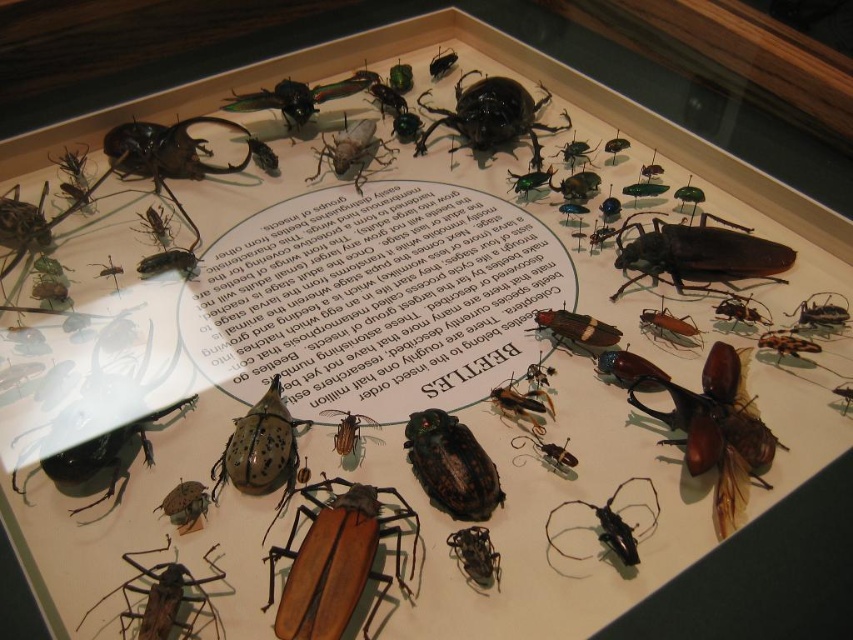
You are a photographer standing 1.2 meters away from the display case. You want to take a closeup photo of the beetle located at point (286, 554). Can you reach it with your camera lens without moving closer than 1.2 meters?

Point (286, 554) is 1.01 meters from the camera, which is closer than your current position of 1.2 meters. Therefore, you cannot reach it without moving closer.

You are a museum visitor standing in front of the display case. You notice the brown matte wood at center and the shiny brown beetle at center. Which object is positioned closer to you?

The brown matte wood at center is closer to the viewer than the shiny brown beetle at center.